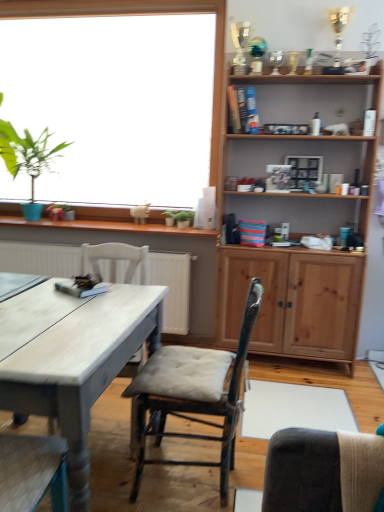
This screenshot has height=512, width=384. I want to click on white painted wood desk at left, so click(x=73, y=359).

How much space does wooden cushioned chair at center, which is the 1th chair in right-to-left order, occupy vertically?

The height of wooden cushioned chair at center, which is the 1th chair in right-to-left order, is 34.07 inches.

What do you see at coordinates (194, 395) in the screenshot? Image resolution: width=384 pixels, height=512 pixels. I see `wooden cushioned chair at center, positioned as the 2th chair in left-to-right order` at bounding box center [194, 395].

Describe the element at coordinates (292, 303) in the screenshot. I see `wooden cabinet at upper right` at that location.

Measure the distance between point [90,257] and camera.

Point [90,257] and camera are 7.44 feet apart.

I want to click on white painted wood desk at left, so click(x=73, y=359).

From a real-world perspective, is green leafy plant at upper left positioned under wooden cushioned chair at center, positioned as the 2th chair in left-to-right order, based on gravity?

Actually, green leafy plant at upper left is physically above wooden cushioned chair at center, positioned as the 2th chair in left-to-right order, in the real world.

Is green leafy plant at upper left looking in the opposite direction of wooden cushioned chair at center, which is the 1th chair in right-to-left order?

No, green leafy plant at upper left is not facing the opposite direction of wooden cushioned chair at center, which is the 1th chair in right-to-left order.

Between green leafy plant at upper left and wooden cushioned chair at center, which is the 1th chair in right-to-left order, which one has larger size?

green leafy plant at upper left is bigger.

Considering their positions, is green leafy plant at upper left located in front of or behind wooden cushioned chair at center, positioned as the 2th chair in left-to-right order?

In the image, green leafy plant at upper left appears behind wooden cushioned chair at center, positioned as the 2th chair in left-to-right order.

Is white wood chair at left, placed as the second chair when sorted from right to left, smaller than green leafy plant at upper left?

Correct, white wood chair at left, placed as the second chair when sorted from right to left, occupies less space than green leafy plant at upper left.

In the scene shown: Which object is more forward, white wood chair at left, which is the first chair in left-to-right order, or green leafy plant at upper left?

white wood chair at left, which is the first chair in left-to-right order, is in front.

Is point (113, 246) more distant than point (39, 157)?

No, (113, 246) is in front of (39, 157).

Identify the location of the 1st chair in front of the green leafy plant at upper left, counting from the anchor's position. (116, 262).

From the image's perspective, is green leafy plant at upper left located above wooden cabinet at upper right?

Yes, from the image's perspective, green leafy plant at upper left is over wooden cabinet at upper right.

Considering the relative sizes of green leafy plant at upper left and wooden cabinet at upper right in the image provided, is green leafy plant at upper left smaller than wooden cabinet at upper right?

Correct, green leafy plant at upper left occupies less space than wooden cabinet at upper right.

Considering their positions, is green leafy plant at upper left located in front of or behind wooden cabinet at upper right?

green leafy plant at upper left is behind wooden cabinet at upper right.

Can we say green leafy plant at upper left lies outside white wood chair at left, which is the first chair in left-to-right order?

Indeed, green leafy plant at upper left is completely outside white wood chair at left, which is the first chair in left-to-right order.

Does green leafy plant at upper left come in front of white wood chair at left, placed as the second chair when sorted from right to left?

No, green leafy plant at upper left is behind white wood chair at left, placed as the second chair when sorted from right to left.

From the image's perspective, is green leafy plant at upper left positioned above or below white wood chair at left, which is the first chair in left-to-right order?

green leafy plant at upper left is above white wood chair at left, which is the first chair in left-to-right order.

From a real-world perspective, between green leafy plant at upper left and white wood chair at left, which is the first chair in left-to-right order, who is vertically higher?

In real-world perspective, green leafy plant at upper left is above.

Choose the correct answer: Is wooden cushioned chair at center, positioned as the 2th chair in left-to-right order, inside white painted wood desk at left or outside it?

wooden cushioned chair at center, positioned as the 2th chair in left-to-right order, is not enclosed by white painted wood desk at left.

Considering the relative sizes of wooden cushioned chair at center, which is the 1th chair in right-to-left order, and white painted wood desk at left in the image provided, is wooden cushioned chair at center, which is the 1th chair in right-to-left order, smaller than white painted wood desk at left?

Correct, wooden cushioned chair at center, which is the 1th chair in right-to-left order, occupies less space than white painted wood desk at left.

From a real-world perspective, who is located higher, wooden cushioned chair at center, which is the 1th chair in right-to-left order, or white painted wood desk at left?

wooden cushioned chair at center, which is the 1th chair in right-to-left order.

Considering the sizes of white wood chair at left, placed as the second chair when sorted from right to left, and wooden cushioned chair at center, which is the 1th chair in right-to-left order, in the image, is white wood chair at left, placed as the second chair when sorted from right to left, bigger or smaller than wooden cushioned chair at center, which is the 1th chair in right-to-left order,?

Considering their sizes, white wood chair at left, placed as the second chair when sorted from right to left, takes up less space than wooden cushioned chair at center, which is the 1th chair in right-to-left order.

You are a GUI agent. You are given a task and a screenshot of the screen. Output one action in this format:
    pyautogui.click(x=<x>, y=<y>)
    Task: Click on the chair on the right side of white wood chair at left, which is the first chair in left-to-right order
    
    Given the screenshot: What is the action you would take?
    pyautogui.click(x=194, y=395)

In terms of width, does white wood chair at left, which is the first chair in left-to-right order, look wider or thinner when compared to wooden cushioned chair at center, which is the 1th chair in right-to-left order?

Considering their sizes, white wood chair at left, which is the first chair in left-to-right order, looks broader than wooden cushioned chair at center, which is the 1th chair in right-to-left order.

Can you tell me how much white wood chair at left, placed as the second chair when sorted from right to left, and wooden cushioned chair at center, positioned as the 2th chair in left-to-right order, differ in facing direction?

There is a 96.4-degree angle between the facing directions of white wood chair at left, placed as the second chair when sorted from right to left, and wooden cushioned chair at center, positioned as the 2th chair in left-to-right order.

From the image's perspective, which one is positioned higher, wooden cushioned chair at center, positioned as the 2th chair in left-to-right order, or white wood chair at left, which is the first chair in left-to-right order?

white wood chair at left, which is the first chair in left-to-right order, from the image's perspective.

Based on the photo, is wooden cushioned chair at center, which is the 1th chair in right-to-left order, with white wood chair at left, which is the first chair in left-to-right order?

No, wooden cushioned chair at center, which is the 1th chair in right-to-left order, is not touching white wood chair at left, which is the first chair in left-to-right order.

How different are the orientations of wooden cushioned chair at center, positioned as the 2th chair in left-to-right order, and white wood chair at left, which is the first chair in left-to-right order, in degrees?

The angular difference between wooden cushioned chair at center, positioned as the 2th chair in left-to-right order, and white wood chair at left, which is the first chair in left-to-right order, is 96.4 degrees.

From a real-world perspective, which is physically below, wooden cushioned chair at center, positioned as the 2th chair in left-to-right order, or white wood chair at left, placed as the second chair when sorted from right to left?

wooden cushioned chair at center, positioned as the 2th chair in left-to-right order, is physically lower.

Find the location of `the 2nd chair below when counting from the green leafy plant at upper left (from the image's perspective)`. the 2nd chair below when counting from the green leafy plant at upper left (from the image's perspective) is located at coordinates (194, 395).

Identify the location of houseplant on the left of white wood chair at left, which is the first chair in left-to-right order. The height and width of the screenshot is (512, 384). (28, 158).

In the scene shown: From the image, which object appears to be nearer to wooden cushioned chair at center, which is the 1th chair in right-to-left order, white wood chair at left, placed as the second chair when sorted from right to left, or wooden cabinet at upper right?

white wood chair at left, placed as the second chair when sorted from right to left, is closer to wooden cushioned chair at center, which is the 1th chair in right-to-left order.

Which object lies further to the anchor point white painted wood desk at left, wooden cabinet at upper right or wooden cushioned chair at center, positioned as the 2th chair in left-to-right order?

Based on the image, wooden cabinet at upper right appears to be further to white painted wood desk at left.

From the image, which object appears to be nearer to white wood chair at left, placed as the second chair when sorted from right to left, white painted wood desk at left or wooden cushioned chair at center, which is the 1th chair in right-to-left order?

Based on the image, white painted wood desk at left appears to be nearer to white wood chair at left, placed as the second chair when sorted from right to left.

Looking at the image, which one is located closer to white wood chair at left, which is the first chair in left-to-right order, wooden cabinet at upper right or white painted wood desk at left?

white painted wood desk at left is closer to white wood chair at left, which is the first chair in left-to-right order.

When comparing their distances from wooden cushioned chair at center, which is the 1th chair in right-to-left order, does green leafy plant at upper left or wooden cabinet at upper right seem closer?

Based on the image, wooden cabinet at upper right appears to be nearer to wooden cushioned chair at center, which is the 1th chair in right-to-left order.

Considering their positions, is green leafy plant at upper left positioned further to wooden cushioned chair at center, positioned as the 2th chair in left-to-right order, than white painted wood desk at left?

green leafy plant at upper left.

Looking at this image, considering their positions, is wooden cabinet at upper right positioned further to wooden cushioned chair at center, positioned as the 2th chair in left-to-right order, than green leafy plant at upper left?

green leafy plant at upper left is further to wooden cushioned chair at center, positioned as the 2th chair in left-to-right order.

From the image, which object appears to be farther from white wood chair at left, which is the first chair in left-to-right order, green leafy plant at upper left or wooden cushioned chair at center, positioned as the 2th chair in left-to-right order?

green leafy plant at upper left.

Locate an element on the screen. This screenshot has height=512, width=384. chair between white painted wood desk at left and white wood chair at left, placed as the second chair when sorted from right to left, from front to back is located at coordinates (194, 395).

Locate an element on the screen. This screenshot has width=384, height=512. chair between wooden cushioned chair at center, which is the 1th chair in right-to-left order, and green leafy plant at upper left, along the z-axis is located at coordinates (116, 262).

This screenshot has width=384, height=512. Identify the location of desk located between green leafy plant at upper left and wooden cabinet at upper right in the left-right direction. (73, 359).

Locate an element on the screen. Image resolution: width=384 pixels, height=512 pixels. chair located between white wood chair at left, which is the first chair in left-to-right order, and wooden cabinet at upper right in the left-right direction is located at coordinates [194, 395].